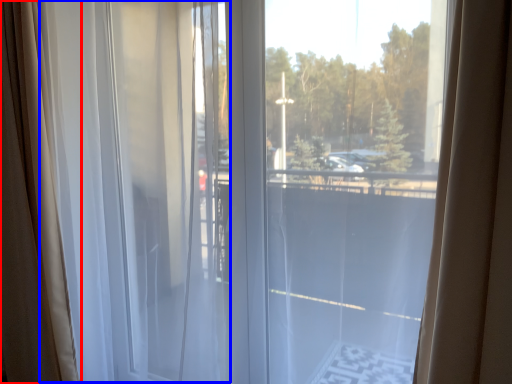
Question: Which of the following is the farthest to the observer, curtain (highlighted by a red box) or curtain (highlighted by a blue box)?

Choices:
 (A) curtain
 (B) curtain

Answer: (A)